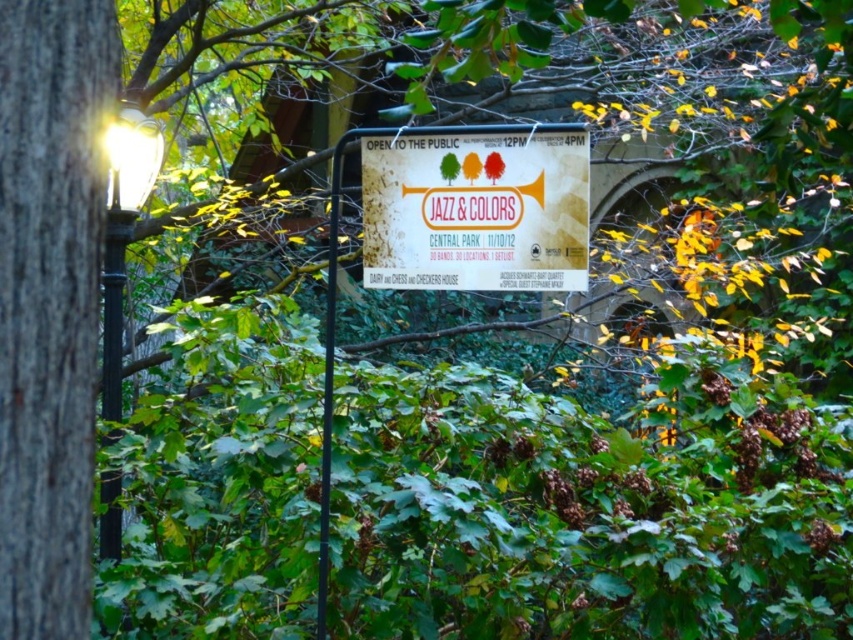
Question: Does white paper sign at center have a smaller size compared to matte black lamp post at left?

Choices:
 (A) no
 (B) yes

Answer: (B)

Question: Does white paper sign at center appear on the right side of matte black lamp post at left?

Choices:
 (A) yes
 (B) no

Answer: (A)

Question: Which point is closer to the camera?

Choices:
 (A) matte black lamp post at left
 (B) white paper sign at center

Answer: (B)

Question: Which object is farther from the camera taking this photo?

Choices:
 (A) white paper sign at center
 (B) matte black lamp post at left

Answer: (B)

Question: Which point appears farthest from the camera in this image?

Choices:
 (A) 138,200
 (B) 540,128

Answer: (A)

Question: Does white paper sign at center appear on the left side of matte black lamp post at left?

Choices:
 (A) no
 (B) yes

Answer: (A)